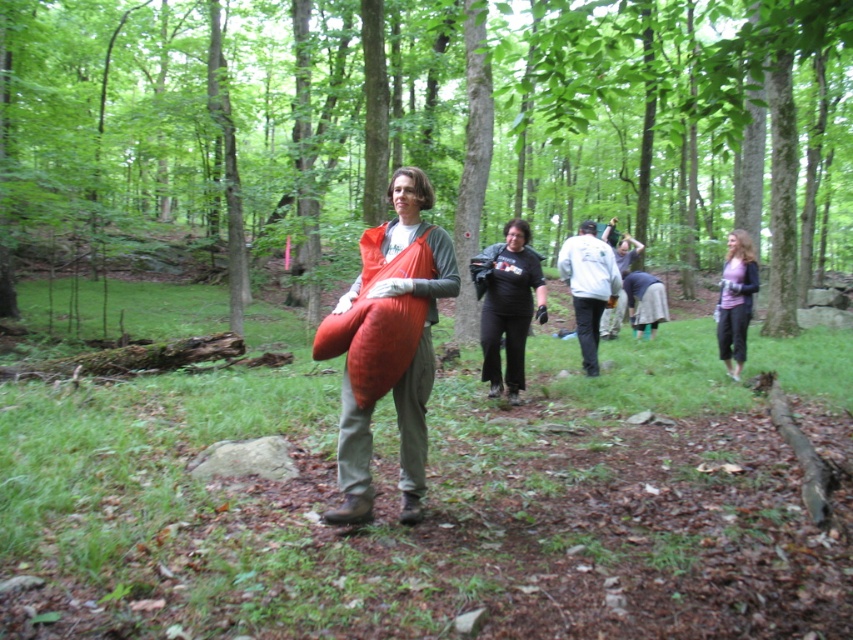
Question: Can you confirm if matte orange fabric bag at center is positioned above denim skirt at center?

Choices:
 (A) yes
 (B) no

Answer: (B)

Question: Which point is farther to the camera?

Choices:
 (A) (364, 268)
 (B) (599, 285)
 (C) (527, 77)
 (D) (738, 289)

Answer: (B)

Question: Estimate the real-world distances between objects in this image. Which object is closer to the denim skirt at center?

Choices:
 (A) black matte shirt at center
 (B) matte pink sweater at right

Answer: (B)

Question: Which object is the closest to the green leafy tree at center?

Choices:
 (A) denim skirt at center
 (B) matte pink sweater at right

Answer: (A)

Question: Does black matte shirt at center have a smaller size compared to white matte jacket at center?

Choices:
 (A) yes
 (B) no

Answer: (A)

Question: Is green leafy tree at center positioned before denim skirt at center?

Choices:
 (A) no
 (B) yes

Answer: (B)